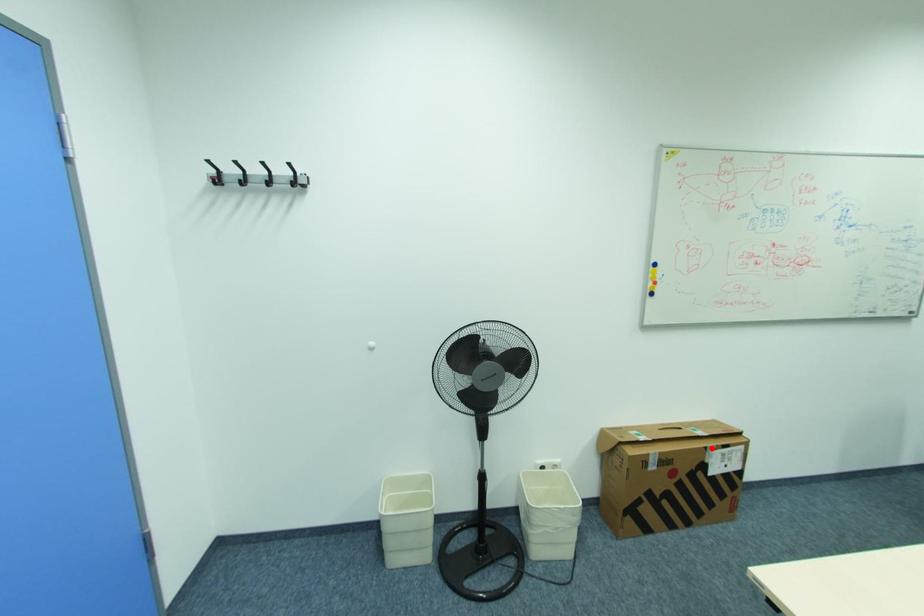
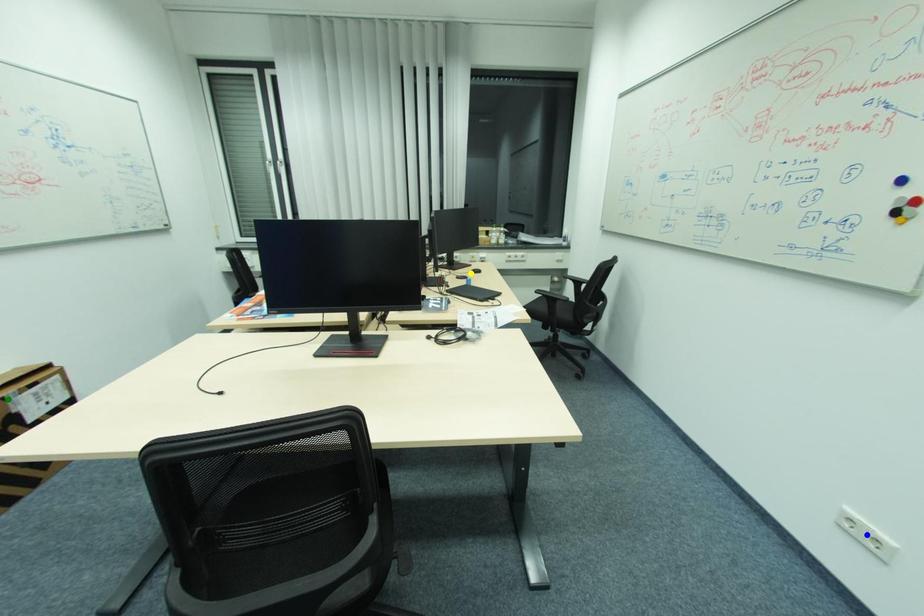
Question: I am providing you with two images of the same scene from different viewpoints. A red point is marked on the first image. You are given multiple points on the second image. Which point in image 2 is actually the same real-world point as the red point in image 1?

Choices:
 (A) blue point
 (B) green point
 (C) yellow point

Answer: (B)